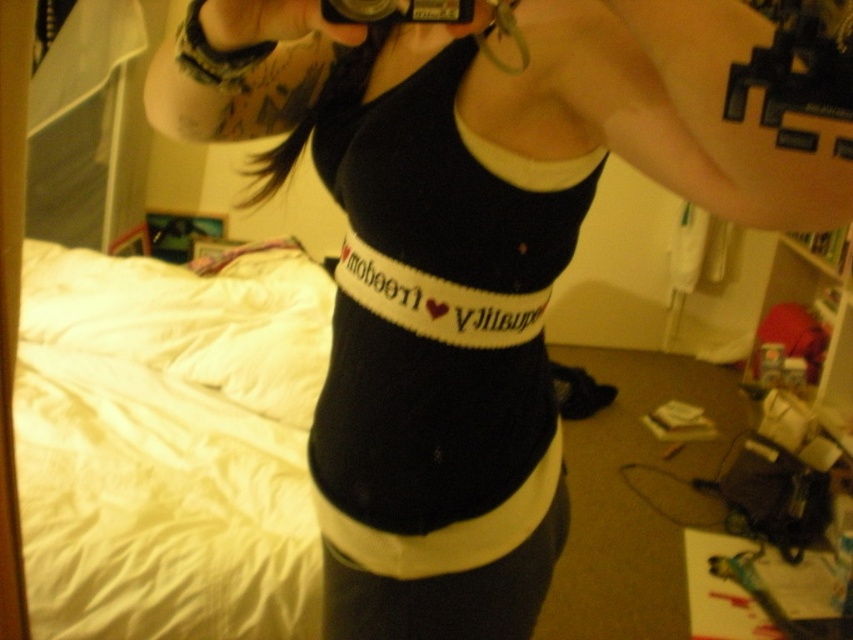
Does white cotton bed at left appear on the right side of black knitted belt at center?

Incorrect, white cotton bed at left is not on the right side of black knitted belt at center.

Is white cotton bed at left further to camera compared to black knitted belt at center?

Yes.

The image size is (853, 640). What do you see at coordinates (167, 445) in the screenshot?
I see `white cotton bed at left` at bounding box center [167, 445].

Where is `white cotton bed at left`? white cotton bed at left is located at coordinates (167, 445).

Which is behind, point (560, 426) or point (384, 13)?

The point (560, 426) is more distant.

Who is positioned more to the left, black knitted belt at center or black plastic camera at upper center?

Positioned to the left is black plastic camera at upper center.

Describe the element at coordinates (445, 529) in the screenshot. The height and width of the screenshot is (640, 853). I see `black knitted belt at center` at that location.

The height and width of the screenshot is (640, 853). Find the location of `black knitted belt at center`. black knitted belt at center is located at coordinates (445, 529).

Is point (131, 468) farther from viewer compared to point (363, 13)?

Yes, point (131, 468) is farther from viewer.

Can you confirm if white cotton bed at left is smaller than black plastic camera at upper center?

Actually, white cotton bed at left might be larger than black plastic camera at upper center.

Identify the location of white cotton bed at left. The image size is (853, 640). (167, 445).

The image size is (853, 640). In order to click on white cotton bed at left in this screenshot , I will do `click(167, 445)`.